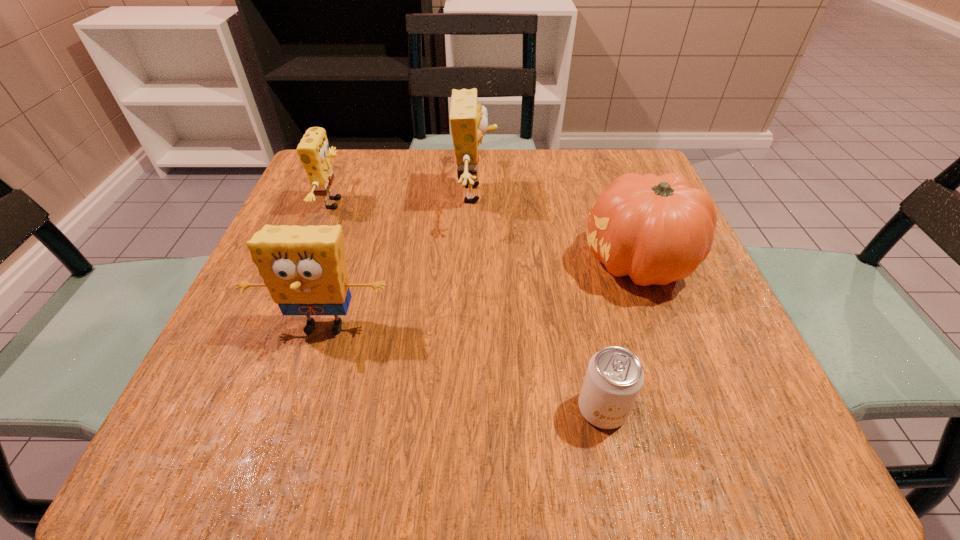
The image size is (960, 540). I want to click on the third object from left to right, so click(468, 120).

The image size is (960, 540). I want to click on the nearest sponge, so click(304, 268).

At what (x,y) coordinates should I click in order to perform the action: click on pumpkin. Please return your answer as a coordinate pair (x, y). This screenshot has width=960, height=540. Looking at the image, I should click on (657, 229).

This screenshot has width=960, height=540. Find the location of `the shortest sponge`. the shortest sponge is located at coordinates (314, 153).

Locate an element on the screen. The height and width of the screenshot is (540, 960). the nearest object is located at coordinates (614, 377).

Locate an element on the screen. The height and width of the screenshot is (540, 960). soda can is located at coordinates (614, 377).

What are the coordinates of `vacant space located on the face of the third object from right to left` in the screenshot? It's located at (653, 194).

Find the location of a particular element. This screenshot has height=540, width=960. free space located 0.080m on the face of the fourth farthest object is located at coordinates (302, 395).

What are the coordinates of `blank space located 0.130m on the carved face of the pumpkin` in the screenshot? It's located at (512, 262).

Identify the location of free spot located on the carved face of the pumpkin. Image resolution: width=960 pixels, height=540 pixels. (495, 262).